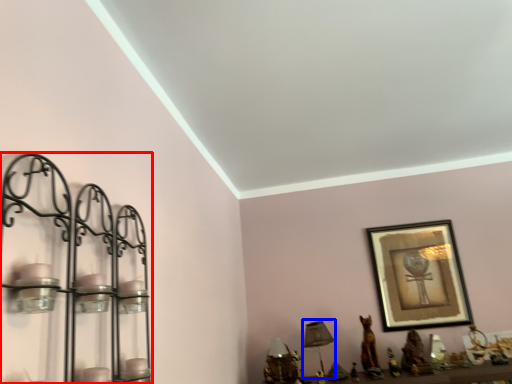
Question: Which object appears closest to the camera in this image, shelf (highlighted by a red box) or table lamp (highlighted by a blue box)?

Choices:
 (A) shelf
 (B) table lamp

Answer: (A)